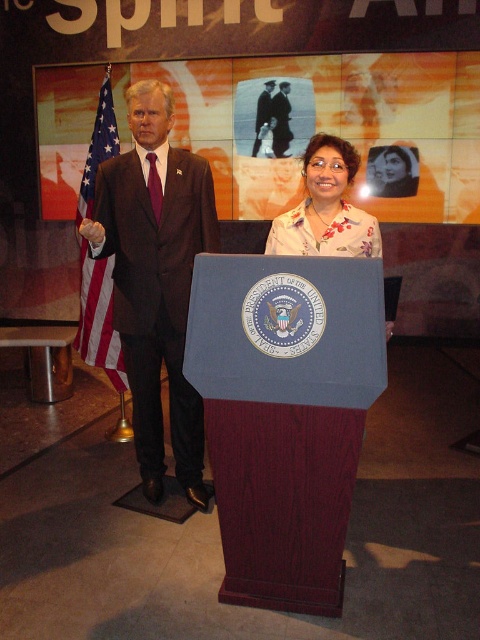
You are attending a presidential event and see two individuals behind the podium. One is wearing a dark suit at center and the other a dark blue suit at center. Which individual is wearing a larger suit?

The dark suit at center has a larger size compared to the dark blue suit at center, so the individual wearing the dark suit at center is wearing the larger suit.